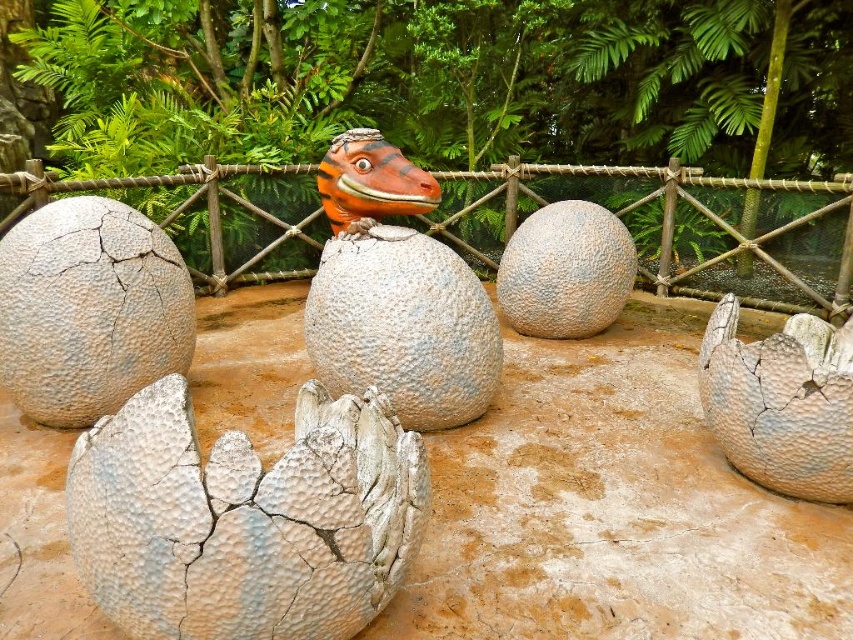
The width and height of the screenshot is (853, 640). What do you see at coordinates (90, 308) in the screenshot?
I see `gray cracked egg at center` at bounding box center [90, 308].

Is gray cracked egg at center in front of gray textured egg at center?

That is True.

Locate an element on the screen. gray cracked egg at center is located at coordinates (90, 308).

Find the location of a particular element. The image size is (853, 640). gray cracked egg at center is located at coordinates (90, 308).

Is point (399, 435) farther from viewer compared to point (573, 221)?

No.

Is white cracked egg at center shorter than gray textured egg at center?

Yes, white cracked egg at center is shorter than gray textured egg at center.

What do you see at coordinates (245, 518) in the screenshot? I see `white cracked egg at center` at bounding box center [245, 518].

The image size is (853, 640). In order to click on white cracked egg at center in this screenshot , I will do `click(245, 518)`.

Does point (94, 394) lie behind point (846, 298)?

No, it is in front of (846, 298).

Is gray cracked egg at center shorter than rope mesh at center?

Yes, gray cracked egg at center is shorter than rope mesh at center.

Is point (45, 352) more distant than point (674, 280)?

That is False.

Locate an element on the screen. gray cracked egg at center is located at coordinates (90, 308).